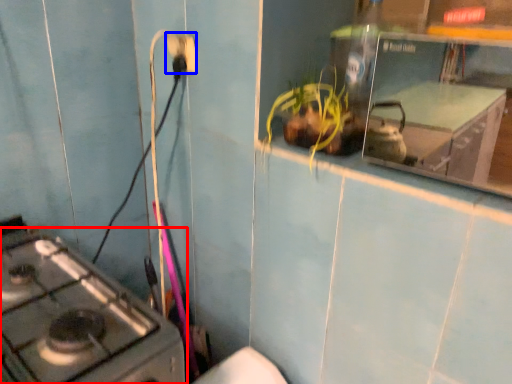
Question: Which object is further to the camera taking this photo, gas stove (highlighted by a red box) or electric outlet (highlighted by a blue box)?

Choices:
 (A) gas stove
 (B) electric outlet

Answer: (B)